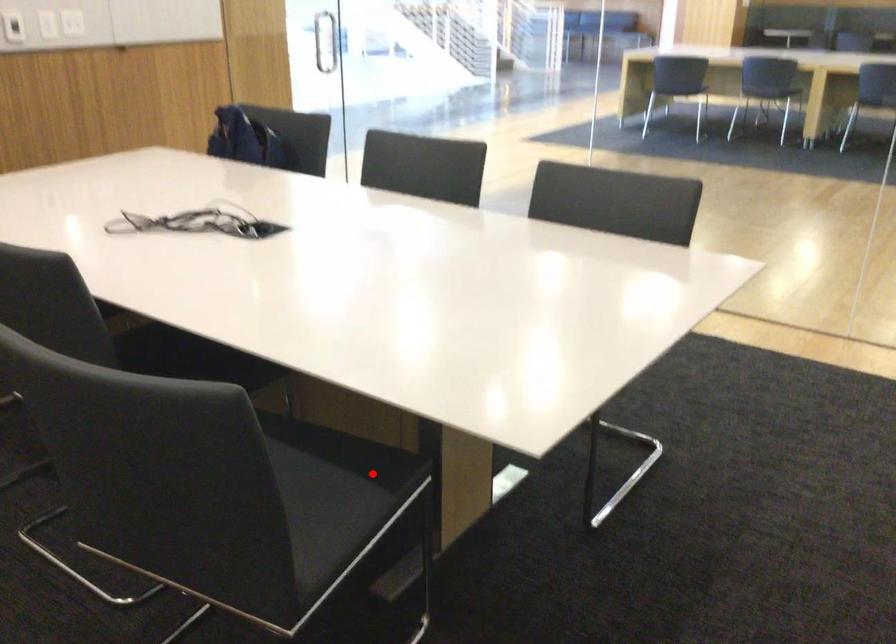
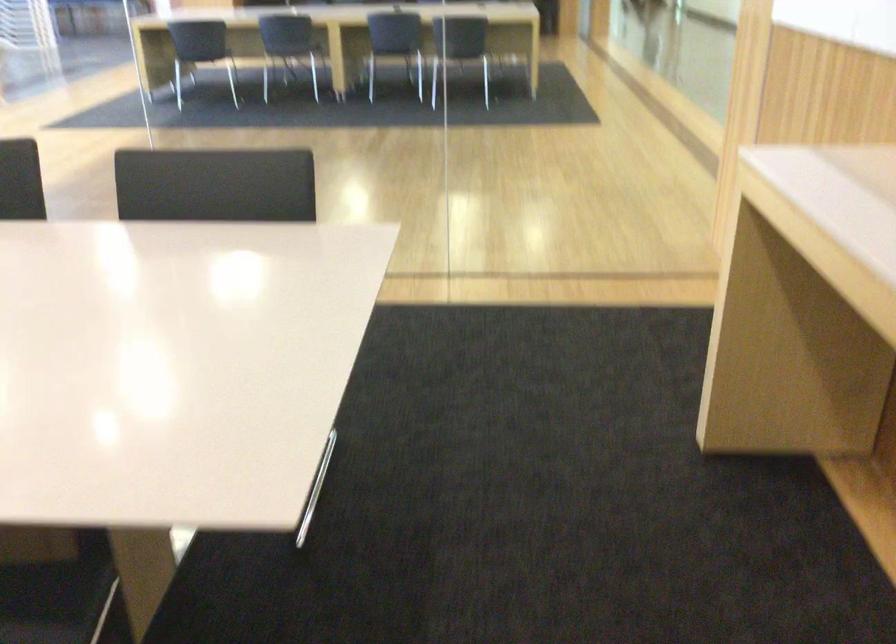
Locate, in the second image, the point that corresponds to the highlighted location in the first image.

(55, 601)